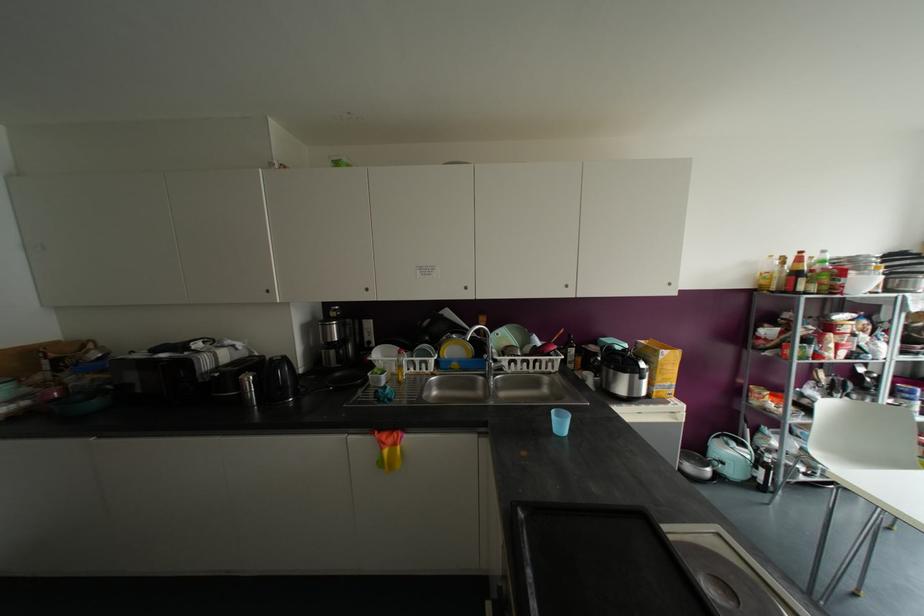
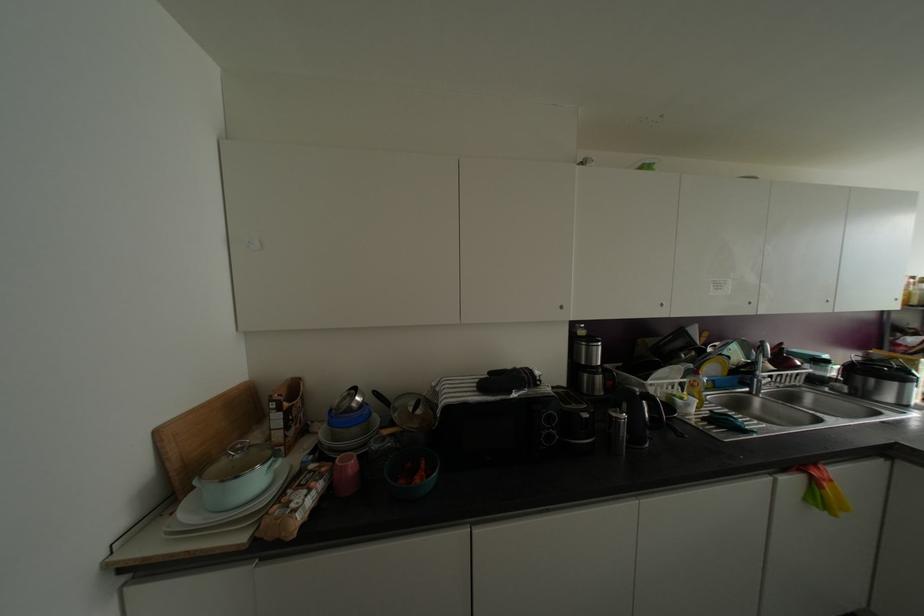
Question: In a continuous first-person perspective shot, in which direction is the camera moving?

Choices:
 (A) Left
 (B) Right
 (C) Forward
 (D) Backward

Answer: (A)